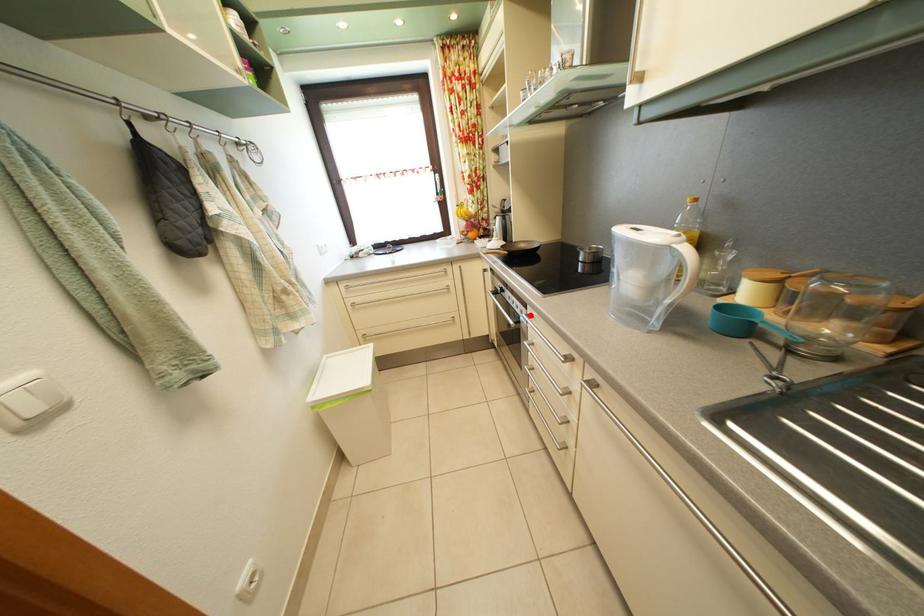
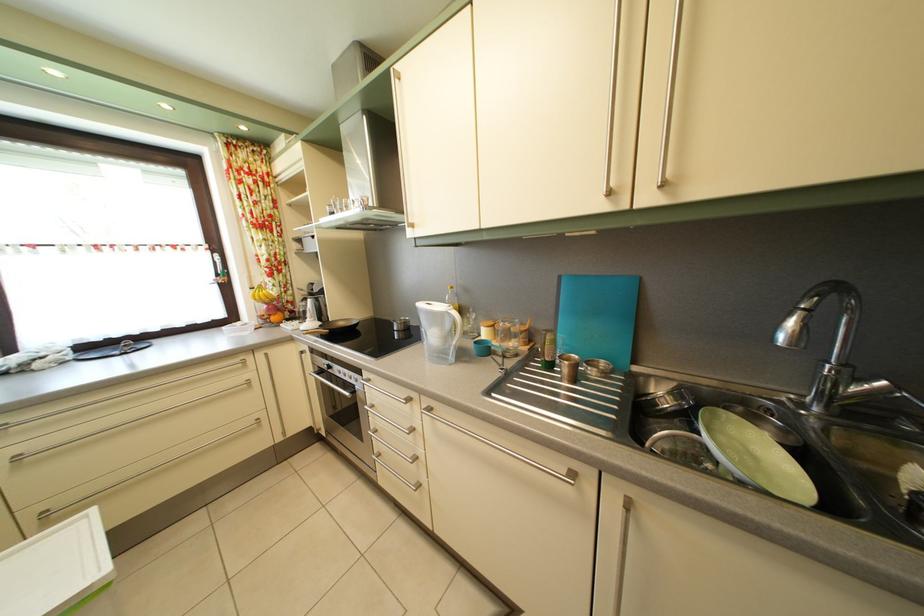
Question: I am providing you with two images of the same scene from different viewpoints. Image1 has a red point marked. In image2, the corresponding 3D location appears at what relative position? Reply with the corresponding letter.

Choices:
 (A) Closer
 (B) Farther

Answer: (B)